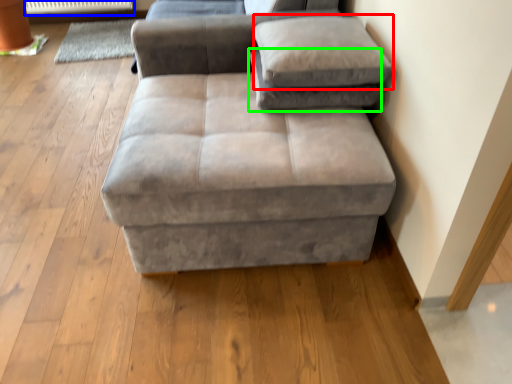
Question: Which object is the closest to the pillow (highlighted by a red box)? Choose among these: radiator (highlighted by a blue box) or pillow (highlighted by a green box).

Choices:
 (A) radiator
 (B) pillow

Answer: (B)